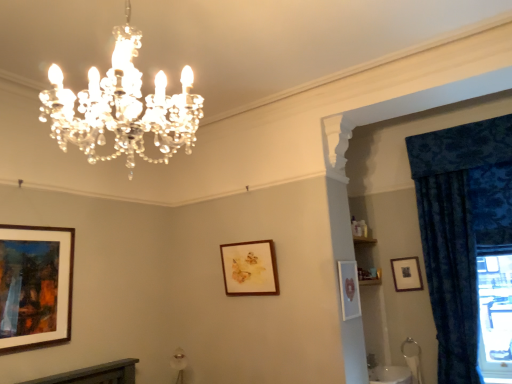
Question: Is wooden picture frame at upper right, which is the 1th picture frame in right-to-left order, far from matte white picture frame at center-right, positioned as the 3th picture frame in back-to-front order?

Choices:
 (A) yes
 (B) no

Answer: (B)

Question: Does wooden picture frame at upper right, which is the 1th picture frame in right-to-left order, lie behind matte white picture frame at center-right, positioned as the second picture frame in right-to-left order?

Choices:
 (A) no
 (B) yes

Answer: (B)

Question: From the image's perspective, would you say wooden picture frame at upper right, positioned as the fourth picture frame in front-to-back order, is positioned over matte white picture frame at center-right, the second picture frame viewed from the front?

Choices:
 (A) no
 (B) yes

Answer: (A)

Question: Is wooden picture frame at upper right, acting as the 1th picture frame starting from the back, outside of matte white picture frame at center-right, positioned as the second picture frame in right-to-left order?

Choices:
 (A) yes
 (B) no

Answer: (A)

Question: Could you tell me if wooden picture frame at upper right, which is the 1th picture frame in right-to-left order, is turned towards matte white picture frame at center-right, positioned as the second picture frame in right-to-left order?

Choices:
 (A) yes
 (B) no

Answer: (A)

Question: From the image's perspective, is wooden picture frame at upper right, which is the 1th picture frame in right-to-left order, beneath matte white picture frame at center-right, positioned as the 3th picture frame in back-to-front order?

Choices:
 (A) no
 (B) yes

Answer: (B)

Question: From the image's perspective, is clear crystal chandelier at upper center below velvet blue curtain at right?

Choices:
 (A) no
 (B) yes

Answer: (A)

Question: Is there a large distance between clear crystal chandelier at upper center and velvet blue curtain at right?

Choices:
 (A) yes
 (B) no

Answer: (A)

Question: From a real-world perspective, is clear crystal chandelier at upper center below velvet blue curtain at right?

Choices:
 (A) no
 (B) yes

Answer: (A)

Question: Does clear crystal chandelier at upper center have a lesser width compared to velvet blue curtain at right?

Choices:
 (A) no
 (B) yes

Answer: (A)

Question: Is clear crystal chandelier at upper center taller than velvet blue curtain at right?

Choices:
 (A) yes
 (B) no

Answer: (B)

Question: Can you confirm if clear crystal chandelier at upper center is wider than velvet blue curtain at right?

Choices:
 (A) no
 (B) yes

Answer: (B)

Question: Is clear crystal chandelier at upper center positioned far away from wooden picture frame at upper right, which is the 1th picture frame in right-to-left order?

Choices:
 (A) no
 (B) yes

Answer: (B)